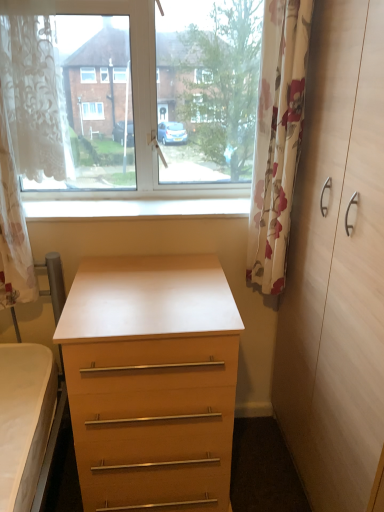
Locate an element on the screen. free spot above matte wood chest of drawers at center (from a real-world perspective) is located at coordinates (149, 290).